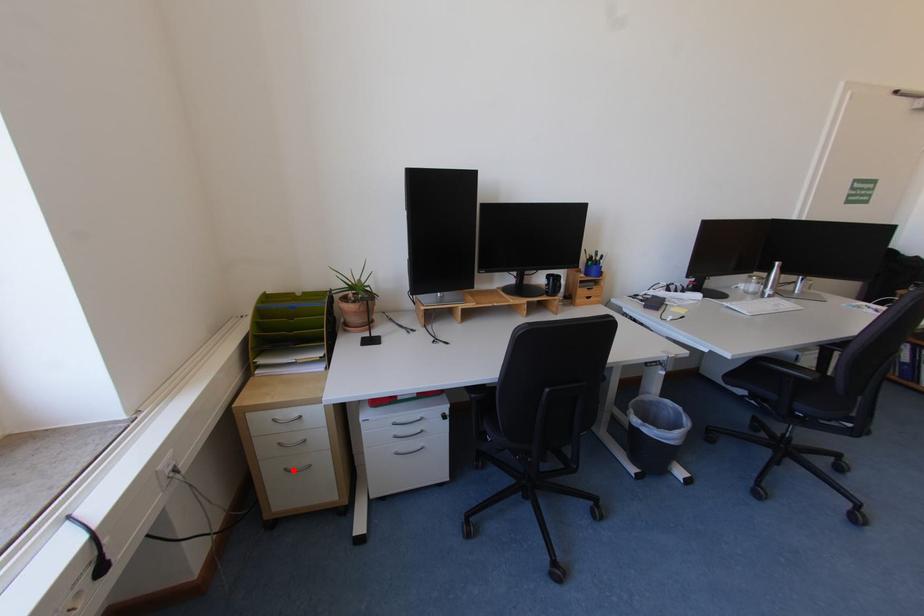
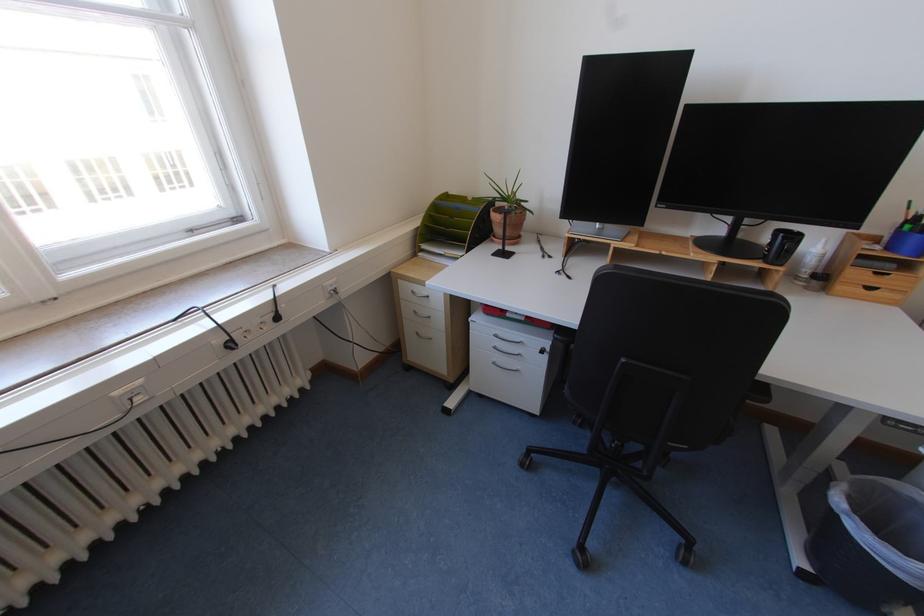
In the second image, find the point that corresponds to the highlighted location in the first image.

(426, 334)